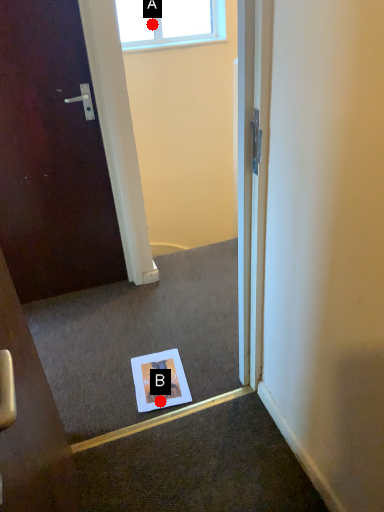
Question: Two points are circled on the image, labeled by A and B beside each circle. Which of the following is the farthest from the observer?

Choices:
 (A) A is further
 (B) B is further

Answer: (A)